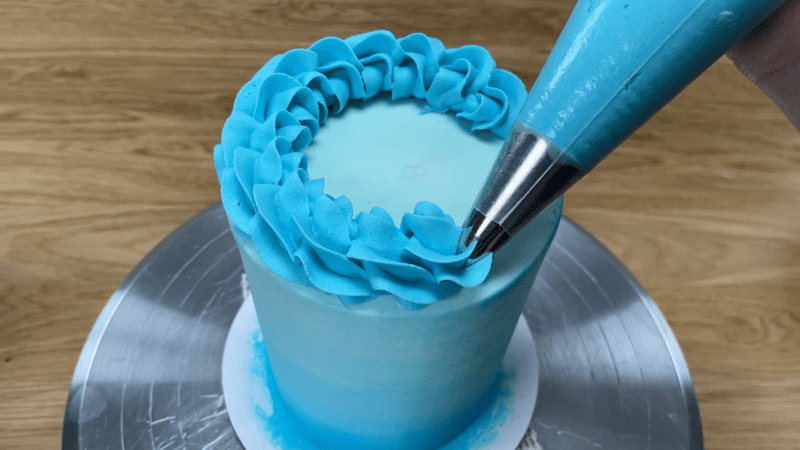
Identify the location of wooden surface. (66, 99), (730, 216).